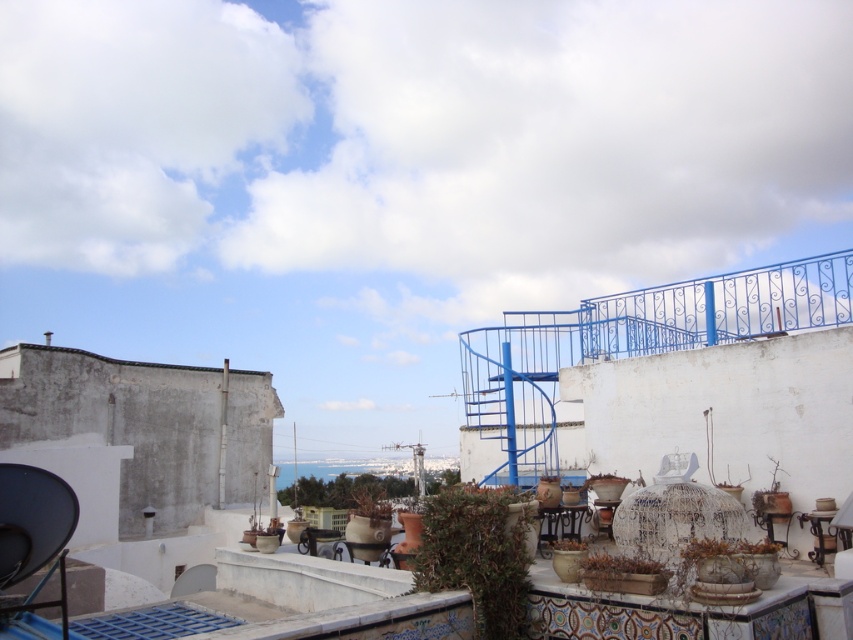
Is brown wooden planter at center wider than green matte plant at lower right?

Yes.

Does brown wooden planter at center appear over green matte plant at lower right?

Yes, brown wooden planter at center is above green matte plant at lower right.

Who is more distant from viewer, (585, 570) or (772, 470)?

The point (772, 470) is behind.

Where is `brown wooden planter at center`? brown wooden planter at center is located at coordinates tap(624, 573).

Is green matte plant at center above green matte plant at lower right?

Yes, green matte plant at center is above green matte plant at lower right.

Who is more forward, [415,570] or [779,484]?

Point [415,570]

Is point (496, 625) more distant than point (772, 460)?

No, (496, 625) is closer to viewer.

This screenshot has height=640, width=853. Find the location of `green matte plant at center`. green matte plant at center is located at coordinates (476, 556).

Is green matte plant at center positioned in front of brown wooden planter at center?

No, it is not.

Who is more distant from viewer, (428, 518) or (618, 592)?

The point (428, 518) is more distant.

Who is more distant from viewer, (447,525) or (618,561)?

The point (447,525) is behind.

You are a GUI agent. You are given a task and a screenshot of the screen. Output one action in this format:
    pyautogui.click(x=<x>, y=<y>)
    Task: Click on the green matte plant at center
    The width and height of the screenshot is (853, 640).
    Given the screenshot: What is the action you would take?
    pos(476,556)